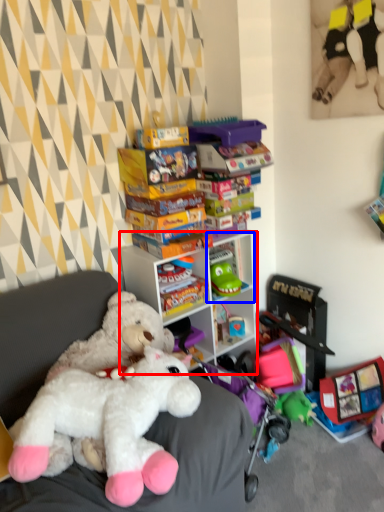
Question: Which object appears closest to the camera in this image, cabinetry (highlighted by a red box) or shelf (highlighted by a blue box)?

Choices:
 (A) cabinetry
 (B) shelf

Answer: (A)